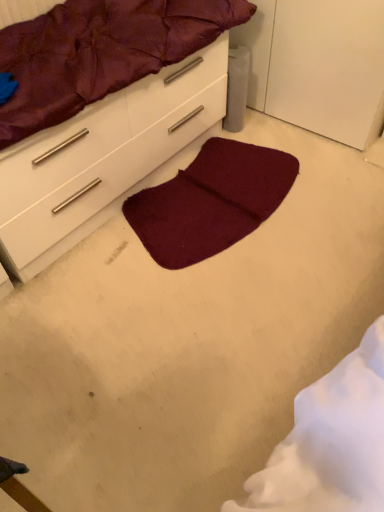
This screenshot has height=512, width=384. What are the coordinates of `free space above burgundy plush mat at center (from a real-world perspective)` in the screenshot? It's located at (220, 179).